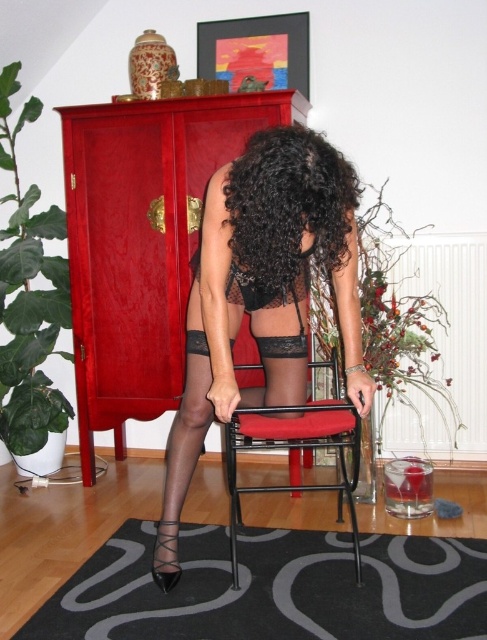
Is black curly hair at center to the left of black metal chair at center from the viewer's perspective?

Indeed, black curly hair at center is positioned on the left side of black metal chair at center.

How much distance is there between black curly hair at center and black metal chair at center?

A distance of 26.20 inches exists between black curly hair at center and black metal chair at center.

Locate an element on the screen. This screenshot has width=487, height=640. black curly hair at center is located at coordinates (287, 205).

Can you confirm if shiny lacquered cabinet at center is positioned to the left of matte black lingerie at center?

Correct, you'll find shiny lacquered cabinet at center to the left of matte black lingerie at center.

Is shiny lacquered cabinet at center positioned at the back of matte black lingerie at center?

Yes, it is behind matte black lingerie at center.

This screenshot has width=487, height=640. In order to click on shiny lacquered cabinet at center in this screenshot , I will do `click(142, 241)`.

Where is `shiny lacquered cabinet at center`? Image resolution: width=487 pixels, height=640 pixels. shiny lacquered cabinet at center is located at coordinates (142, 241).

Can you confirm if black metal chair at center is wider than matte black shoe at lower center?

Indeed, black metal chair at center has a greater width compared to matte black shoe at lower center.

Is black metal chair at center shorter than matte black shoe at lower center?

In fact, black metal chair at center may be taller than matte black shoe at lower center.

I want to click on black metal chair at center, so click(295, 454).